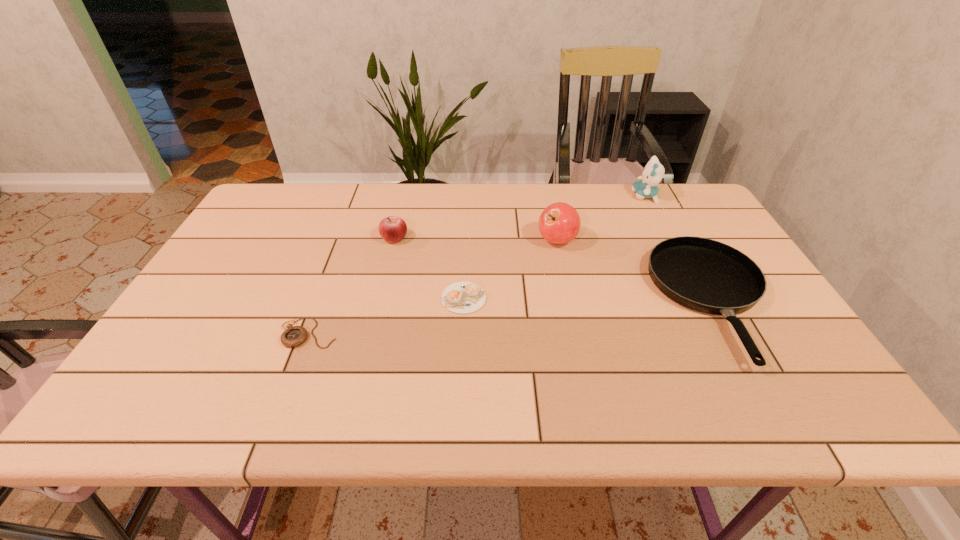
Find the location of a particular element. The image size is (960, 540). free point located 0.150m on the face of the farthest object is located at coordinates (588, 196).

I want to click on blank area located 0.350m on the face of the farthest object, so click(x=527, y=196).

At what (x,y) coordinates should I click in order to perform the action: click on vacant region located 0.240m on the face of the farthest object. Please return your answer as a coordinate pair (x, y). The image size is (960, 540). Looking at the image, I should click on (561, 196).

The width and height of the screenshot is (960, 540). What are the coordinates of `vacant region located on the right of the taller apple` in the screenshot? It's located at (710, 241).

Locate an element on the screen. The height and width of the screenshot is (540, 960). free spot located on the left of the shorter apple is located at coordinates (258, 238).

Find the location of a particular element. The image size is (960, 540). blank space located on the handle side of the frying pan is located at coordinates (766, 396).

Identify the location of free space located on the right of the fourth object from right to left. This screenshot has height=540, width=960. (518, 298).

This screenshot has width=960, height=540. Identify the location of vacant region located 0.110m on the front of the leftmost object. (287, 391).

The image size is (960, 540). Identify the location of object that is at the far edge. (652, 174).

At what (x,y) coordinates should I click in order to perform the action: click on kitten at the right edge. Please return your answer as a coordinate pair (x, y). Looking at the image, I should click on (652, 174).